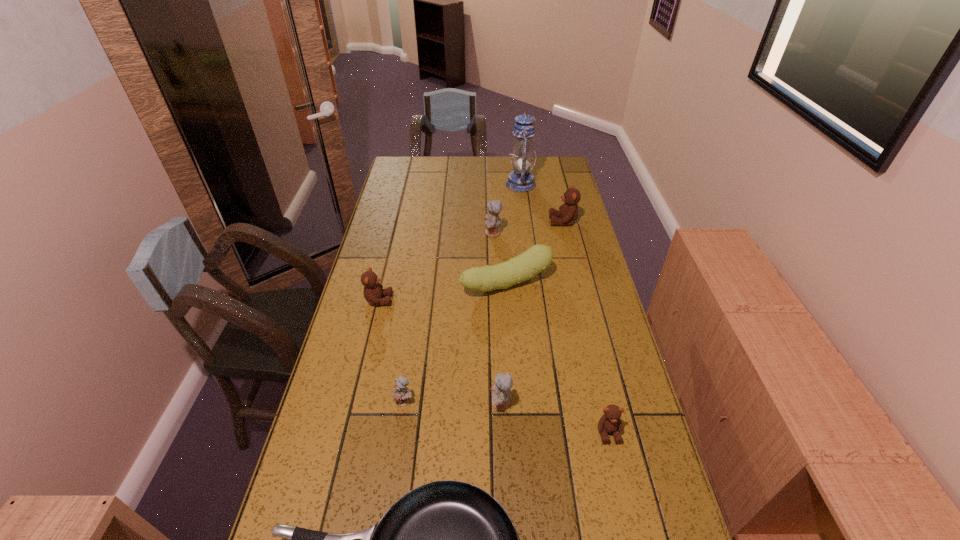
At what (x,y) coordinates should I click in order to perform the action: click on vacant point at the far edge. Please return your answer as a coordinate pair (x, y). The height and width of the screenshot is (540, 960). Looking at the image, I should click on (503, 170).

Image resolution: width=960 pixels, height=540 pixels. I want to click on vacant space at the left edge of the desktop, so click(x=332, y=479).

You are a GUI agent. You are given a task and a screenshot of the screen. Output one action in this format:
    pyautogui.click(x=<x>, y=<y>)
    Task: Click on the free space at the right edge of the desktop
    Image resolution: width=960 pixels, height=540 pixels.
    Given the screenshot: What is the action you would take?
    pyautogui.click(x=559, y=265)

At what (x,y) coordinates should I click in order to perform the action: click on free space between the leftmost brown teddy bear and the farthest object. Please return your answer as a coordinate pair (x, y). This screenshot has height=540, width=960. Looking at the image, I should click on (449, 242).

The width and height of the screenshot is (960, 540). Find the location of `vacant point located between the nearest brown teddy bear and the biggest blue teddy bear`. vacant point located between the nearest brown teddy bear and the biggest blue teddy bear is located at coordinates (550, 333).

Image resolution: width=960 pixels, height=540 pixels. What are the coordinates of `empty space between the farthest object and the second biggest blue teddy bear` in the screenshot? It's located at (511, 294).

Where is `vacant area that lies between the smallest brown teddy bear and the tallest object`? This screenshot has width=960, height=540. vacant area that lies between the smallest brown teddy bear and the tallest object is located at coordinates (x=564, y=308).

The image size is (960, 540). In order to click on free spot between the cucumber and the tallest object in this screenshot , I will do 514,234.

Where is `free space between the second smallest blue teddy bear and the second teddy bear from left to right`? free space between the second smallest blue teddy bear and the second teddy bear from left to right is located at coordinates (452, 402).

You are a GUI agent. You are given a task and a screenshot of the screen. Output one action in this format:
    pyautogui.click(x=<x>, y=<y>)
    Task: Click on the empty space between the farthest blue teddy bear and the second smallest blue teddy bear
    Image resolution: width=960 pixels, height=540 pixels.
    Given the screenshot: What is the action you would take?
    pyautogui.click(x=496, y=319)